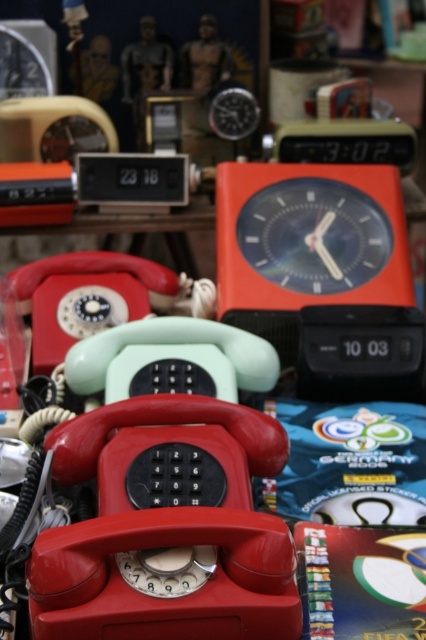
You are setting up a display in an antique shop and need to arrange items so that the matte orange alarm clock at center is visible above the matte plastic telephone at center. Can you adjust their positions to achieve this?

The matte orange alarm clock at center is currently located below the matte plastic telephone at center. To make the alarm clock visible above the telephone, you would need to rearrange them so that the alarm clock is placed above the telephone instead of below it.

You are setting up a display for a vintage electronics exhibition. You have a matte orange alarm clock at center and a matte plastic telephone at center. Which object should you place on the higher shelf if you want to ensure both items are visible to visitors standing at eye level?

The matte orange alarm clock at center is taller than the matte plastic telephone at center, so you should place the matte plastic telephone at center on the higher shelf to ensure both are visible at eye level.